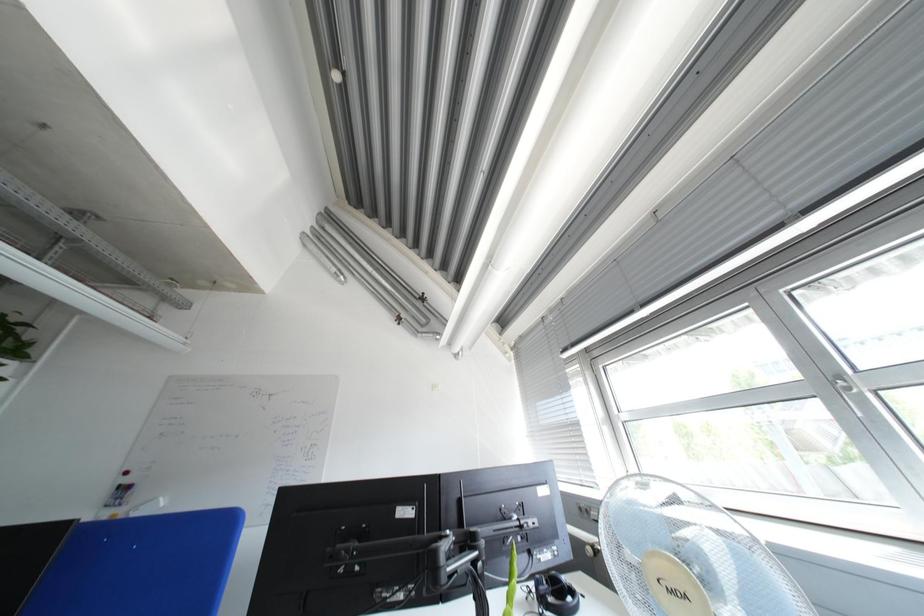
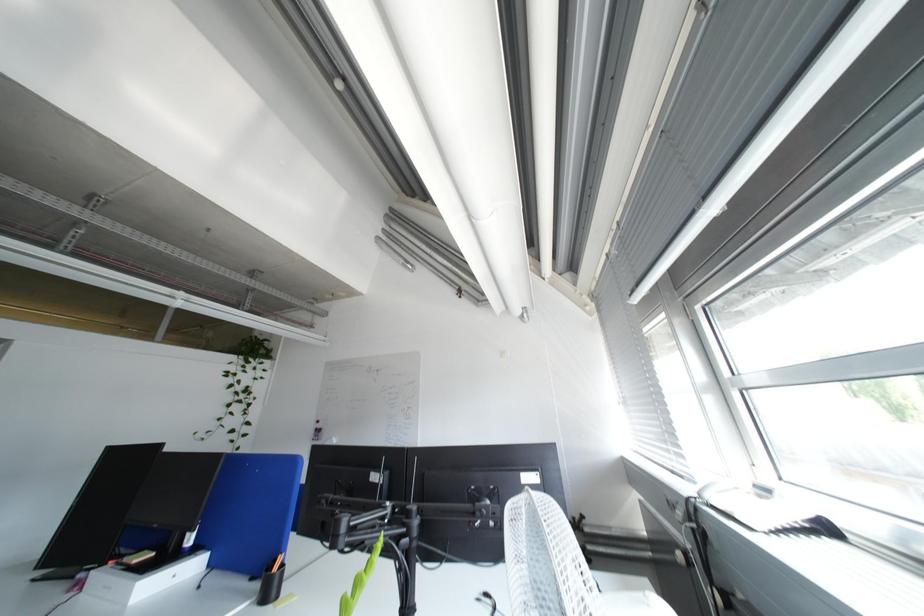
Question: The camera is either moving clockwise (left) or counter-clockwise (right) around the object. The first image is from the beginning of the video and the second image is from the end. Is the camera moving left or right when shooting the video?

Choices:
 (A) Left
 (B) Right

Answer: (B)